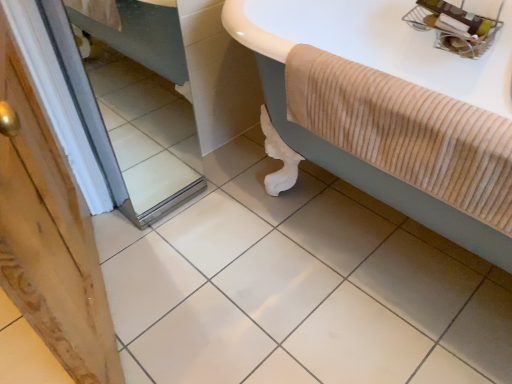
You are a GUI agent. You are given a task and a screenshot of the screen. Output one action in this format:
    pyautogui.click(x=<x>, y=<y>)
    Task: Click on the free spot in front of mirror at left
    The width and height of the screenshot is (512, 384).
    Given the screenshot: What is the action you would take?
    pyautogui.click(x=169, y=251)